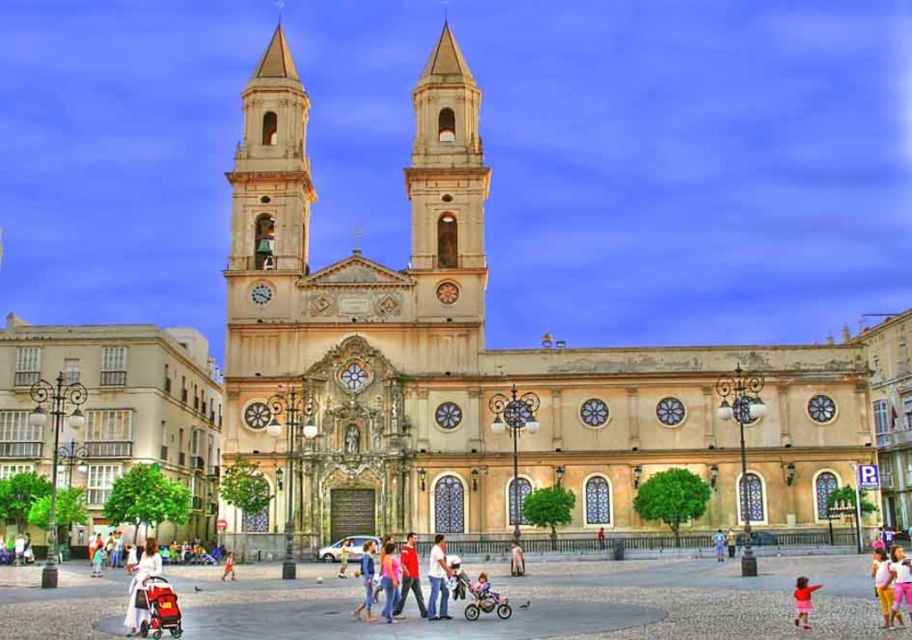
Question: Can you confirm if blue denim jeans at center is positioned below light brown leather jacket at center?

Choices:
 (A) no
 (B) yes

Answer: (A)

Question: Can you confirm if red cotton shirt at center is bigger than white cotton shirt at lower right?

Choices:
 (A) yes
 (B) no

Answer: (B)

Question: Which point is farther from the camera taking this photo?

Choices:
 (A) (148, 544)
 (B) (510, 570)
 (C) (888, 576)
 (D) (793, 595)

Answer: (B)

Question: Which is farther from the blue denim jeans at center?

Choices:
 (A) white cotton shirt at lower right
 (B) pink fabric dress at lower right

Answer: (A)

Question: Among these objects, which one is nearest to the camera?

Choices:
 (A) light blue jeans at center
 (B) white cotton shirt at lower right

Answer: (B)

Question: Is blue denim jeans at center closer to camera compared to pink fabric dress at lower right?

Choices:
 (A) no
 (B) yes

Answer: (A)